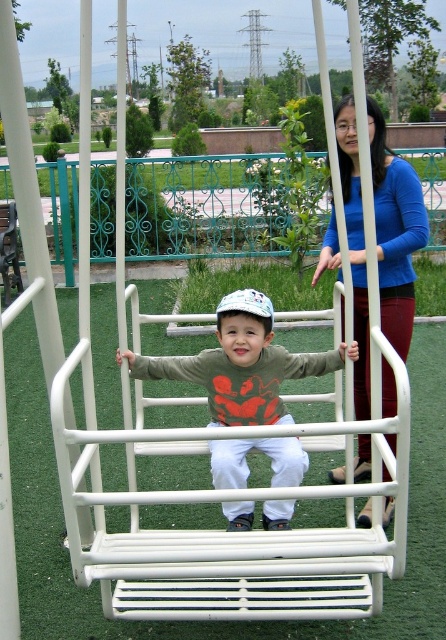
Question: From the image, what is the correct spatial relationship of blue fabric shirt at upper center in relation to matte green sweatshirt at center?

Choices:
 (A) below
 (B) above

Answer: (B)

Question: Observing the image, what is the correct spatial positioning of blue fabric shirt at upper center in reference to matte green sweatshirt at center?

Choices:
 (A) left
 (B) right

Answer: (B)

Question: Which point appears closest to the camera in this image?

Choices:
 (A) (392, 221)
 (B) (227, 392)

Answer: (B)

Question: Can you confirm if blue fabric shirt at upper center is positioned to the left of matte green sweatshirt at center?

Choices:
 (A) yes
 (B) no

Answer: (B)